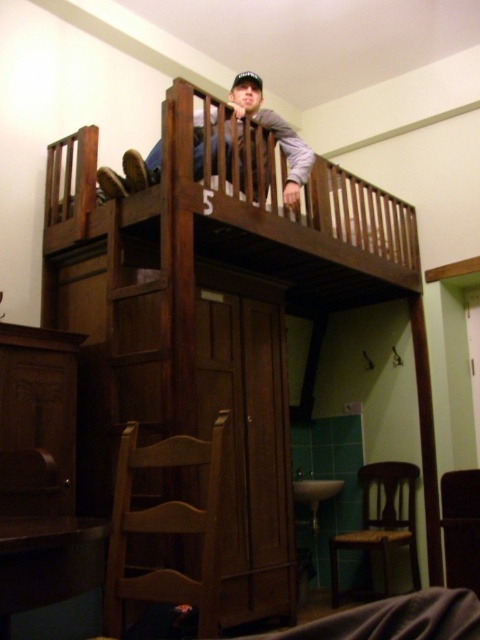
Does brown wooden bunk bed at upper center appear on the left side of wooden bunk bed at upper center?

In fact, brown wooden bunk bed at upper center is to the right of wooden bunk bed at upper center.

Is brown wooden bunk bed at upper center positioned before wooden bunk bed at upper center?

Yes, brown wooden bunk bed at upper center is closer to the viewer.

Which is behind, point (222, 275) or point (149, 173)?

The point (222, 275) is more distant.

Where is `brown wooden bunk bed at upper center`? The height and width of the screenshot is (640, 480). brown wooden bunk bed at upper center is located at coordinates 220,316.